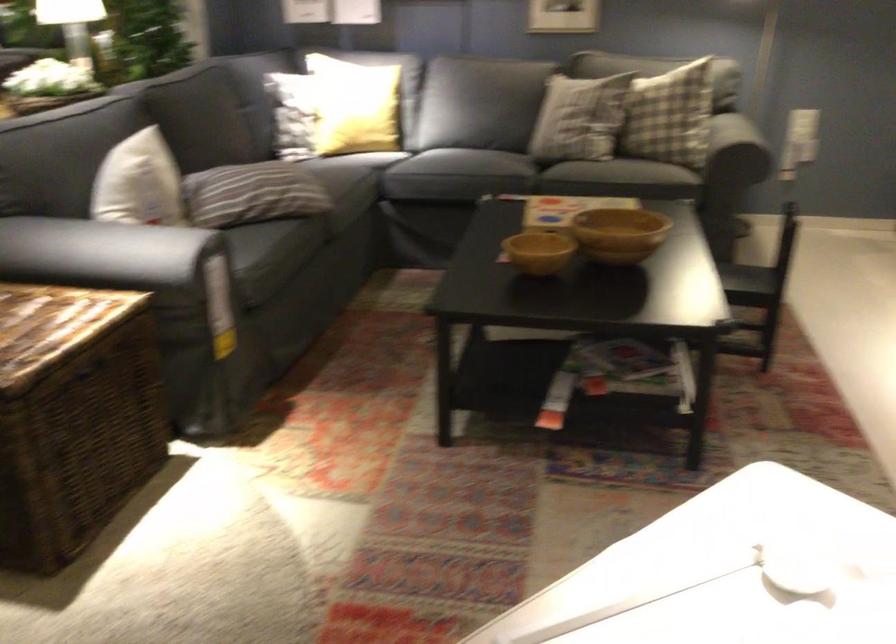
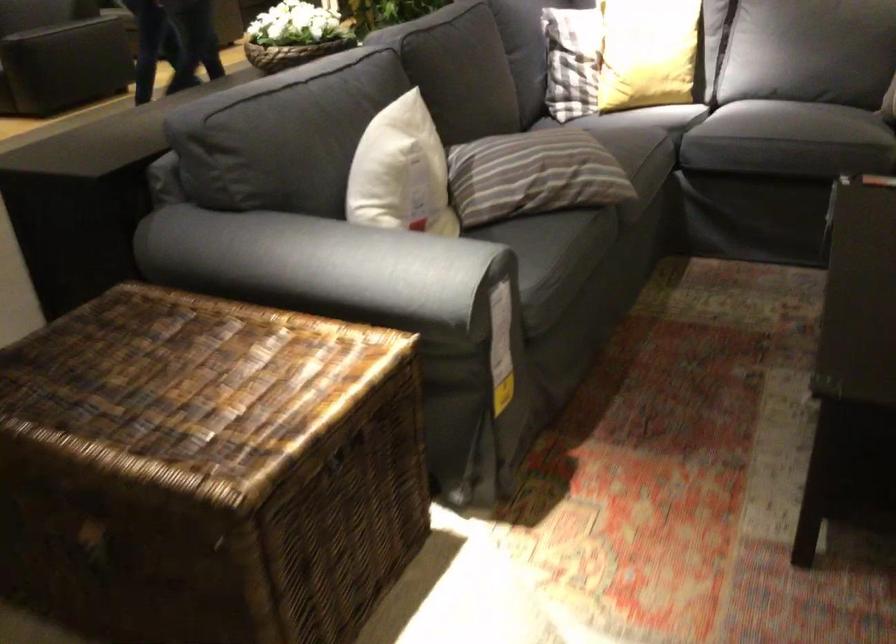
Where in the second image is the point corresponding to (x=140, y=182) from the first image?

(401, 172)